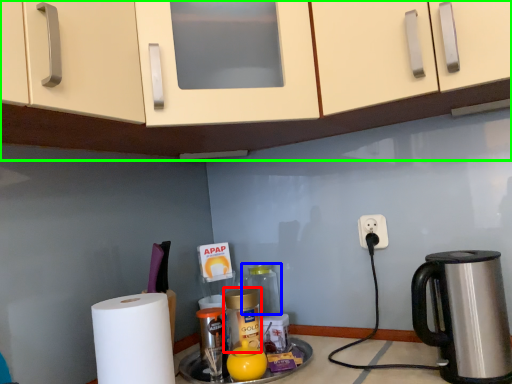
Question: Which object is the closest to the bottle (highlighted by a red box)? Choose among these: bottle (highlighted by a blue box) or cabinetry (highlighted by a green box).

Choices:
 (A) bottle
 (B) cabinetry

Answer: (A)